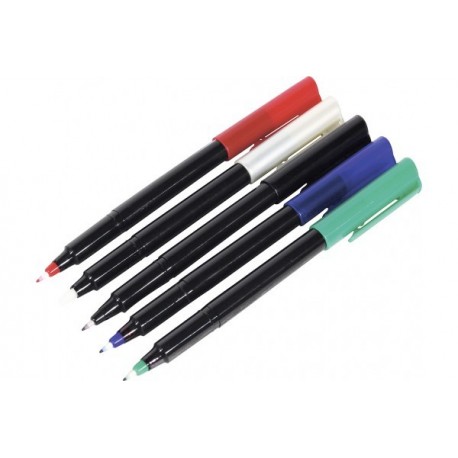
In order to click on pens in this screenshot , I will do `click(188, 171)`, `click(193, 194)`, `click(211, 223)`, `click(225, 257)`, `click(237, 293)`.